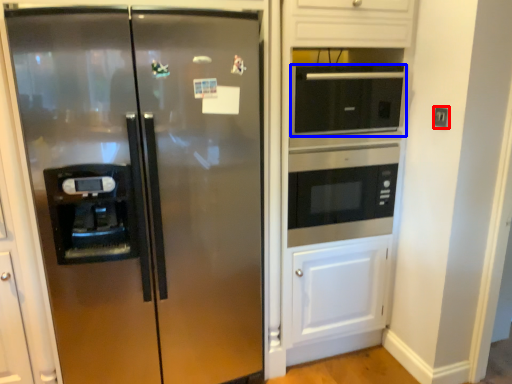
Question: Among these objects, which one is farthest to the camera, electric outlet (highlighted by a red box) or microwave oven (highlighted by a blue box)?

Choices:
 (A) electric outlet
 (B) microwave oven

Answer: (A)